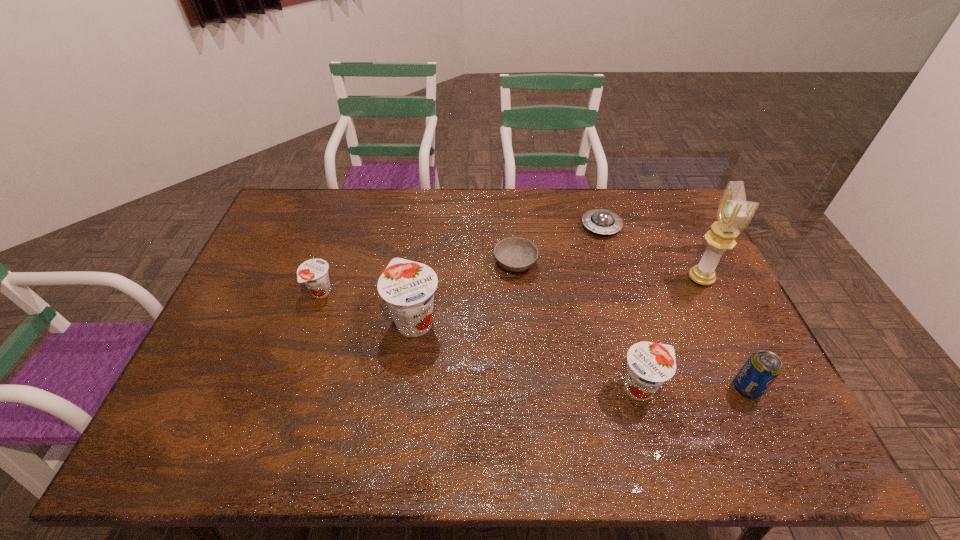
Find the location of `free spot located on the front of the third shortest object`. free spot located on the front of the third shortest object is located at coordinates (304, 341).

Find the location of a particular element. The width and height of the screenshot is (960, 540). free spot located on the left of the sixth shortest object is located at coordinates (327, 320).

In order to click on free point located on the right of the rightmost yogurt in this screenshot , I will do `click(688, 387)`.

At what (x,y) coordinates should I click in order to perform the action: click on vacant area situated on the front of the farthest object. Please return your answer as a coordinate pair (x, y). This screenshot has height=540, width=960. Looking at the image, I should click on (632, 330).

Identify the location of vacant point located on the right of the fifth object from right to left. Image resolution: width=960 pixels, height=540 pixels. (562, 264).

Locate an element on the screen. The height and width of the screenshot is (540, 960). blank space located 0.280m on the front-facing side of the award is located at coordinates (597, 279).

Locate an element on the screen. free spot located on the front-facing side of the award is located at coordinates (642, 279).

You are a GUI agent. You are given a task and a screenshot of the screen. Output one action in this format:
    pyautogui.click(x=<x>, y=<y>)
    Task: Click on the vacant area situated on the front-facing side of the award
    This screenshot has height=540, width=960.
    Given the screenshot: What is the action you would take?
    (x=610, y=279)

Where is `free spot located 0.180m on the back of the soda`? The height and width of the screenshot is (540, 960). free spot located 0.180m on the back of the soda is located at coordinates (715, 320).

Where is `object that is positioned at the far edge`? object that is positioned at the far edge is located at coordinates coord(601,221).